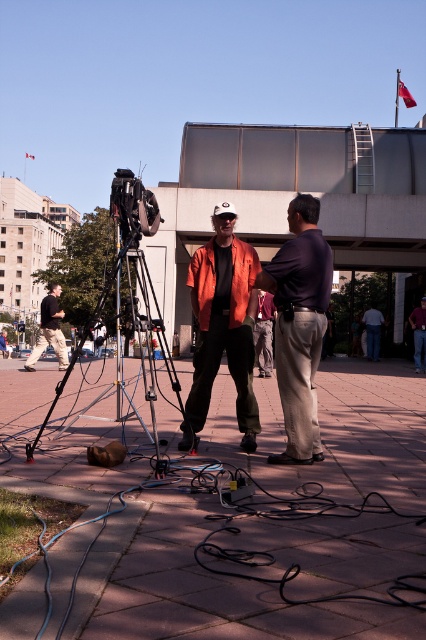
Between black shirt at left and denim jeans at lower right, which one has more height?

black shirt at left is taller.

Which of these two, black shirt at left or denim jeans at lower right, stands shorter?

denim jeans at lower right is shorter.

Is point (57, 333) positioned after point (373, 308)?

No, it is in front of (373, 308).

Find the location of `black shirt at left`. black shirt at left is located at coordinates (49, 330).

Is matte black video camera at left smaller than denim pants at center?

Actually, matte black video camera at left might be larger than denim pants at center.

Locate an element on the screen. The width and height of the screenshot is (426, 640). matte black video camera at left is located at coordinates (132, 208).

At what (x,y) coordinates should I click in order to perform the action: click on matte black video camera at left. Please return your answer as a coordinate pair (x, y). This screenshot has width=426, height=640. Looking at the image, I should click on (132, 208).

Who is more forward, [304,417] or [192,436]?

Point [304,417]

Who is shorter, dark blue shirt at center or orange matte shirt at center?

orange matte shirt at center is shorter.

Between point (316, 440) and point (236, 365), which one is positioned in front?

Positioned in front is point (316, 440).

This screenshot has height=640, width=426. I want to click on dark blue shirt at center, so click(299, 324).